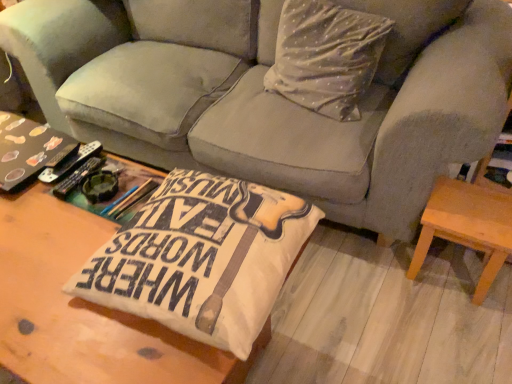
Question: Would you say white dotted fabric pillow at upper center is inside or outside matte black book at left?

Choices:
 (A) outside
 (B) inside

Answer: (A)

Question: Considering their positions, is white dotted fabric pillow at upper center located in front of or behind matte black book at left?

Choices:
 (A) front
 (B) behind

Answer: (B)

Question: Which object is the closest to the matte black book at left?

Choices:
 (A) wooden coffee table at center, marked as the 1th table in a front-to-back arrangement
 (B) light brown wooden stool at lower right, placed as the 2th table when sorted from left to right
 (C) velvet gray couch at center
 (D) white dotted fabric pillow at upper center

Answer: (A)

Question: Which is farther from the matte black book at left?

Choices:
 (A) velvet gray couch at center
 (B) wooden coffee table at center, marked as the 1th table in a front-to-back arrangement
 (C) white dotted fabric pillow at upper center
 (D) light brown wooden stool at lower right, placed as the 2th table when sorted from left to right

Answer: (D)